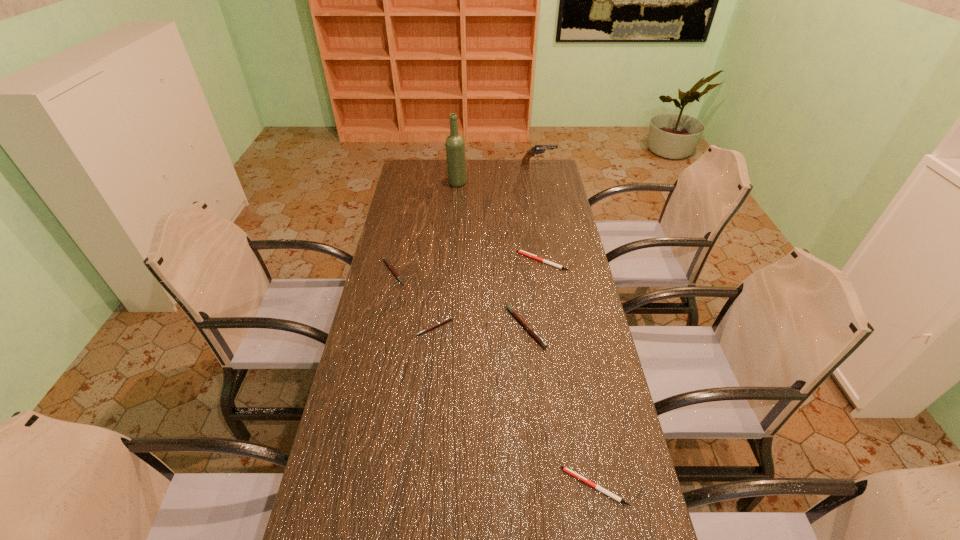
In order to click on free space at the far edge of the desktop in this screenshot , I will do `click(442, 184)`.

Where is `free spot at the left edge of the desktop`? free spot at the left edge of the desktop is located at coordinates (416, 255).

Locate an element on the screen. The height and width of the screenshot is (540, 960). vacant area at the right edge is located at coordinates (553, 354).

At what (x,y) coordinates should I click in order to perform the action: click on free location at the far left corner of the desktop. Please return your answer as a coordinate pair (x, y). Image resolution: width=960 pixels, height=540 pixels. Looking at the image, I should click on (435, 162).

I want to click on vacant space that's between the farther white pen and the second pink pen from right to left, so click(489, 294).

This screenshot has width=960, height=540. Find the location of `blank region between the tallest object and the nearest object`. blank region between the tallest object and the nearest object is located at coordinates (526, 335).

At what (x,y) coordinates should I click in order to perform the action: click on vacant area that lies between the second pen from left to right and the smaller white pen. Please return your answer as a coordinate pair (x, y). This screenshot has width=960, height=540. Looking at the image, I should click on (515, 407).

Locate an element on the screen. The image size is (960, 540). blank region between the nearest object and the tallest object is located at coordinates (526, 335).

Locate an element on the screen. The width and height of the screenshot is (960, 540). free area in between the rightmost pink pen and the nearest object is located at coordinates (560, 406).

Locate an element on the screen. The width and height of the screenshot is (960, 540). vacant area between the smaller white pen and the farthest object is located at coordinates (566, 326).